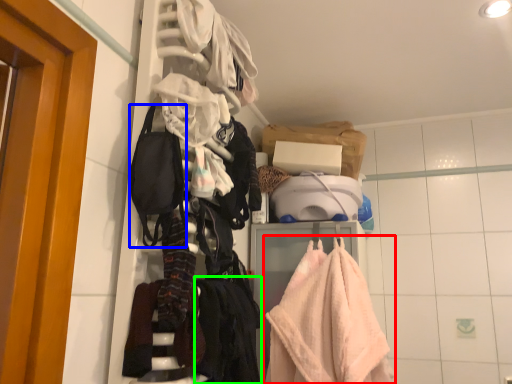
Question: Which object is positioned closest to towel (highlighted by a red box)? Select from accessory (highlighted by a blue box) and clothing (highlighted by a green box).

Choices:
 (A) accessory
 (B) clothing

Answer: (B)